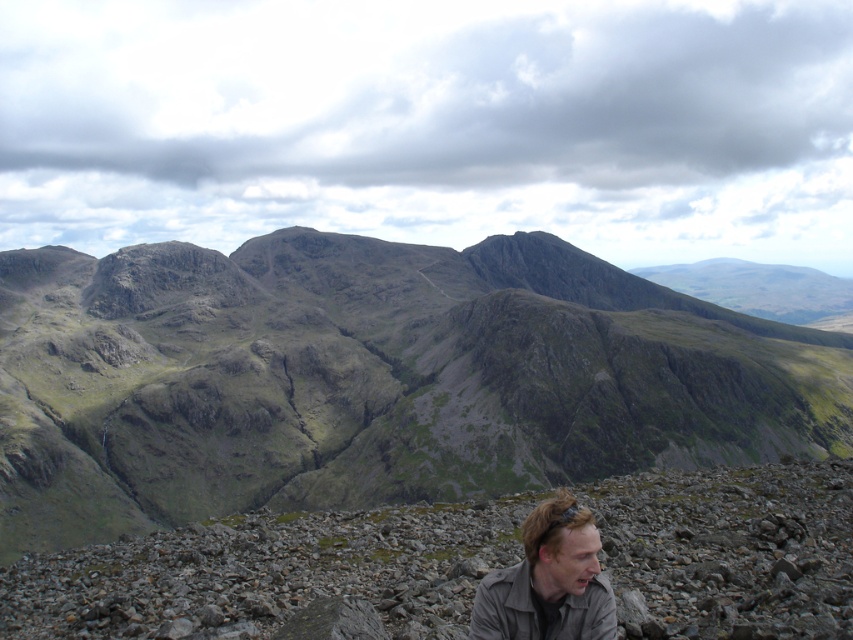
Question: Which object is the closest to the gray gravelly rocks at lower right?

Choices:
 (A) rugged stone mountain at center
 (B) light brown leather jacket at lower center

Answer: (B)

Question: Based on their relative distances, which object is farther from the gray gravelly rocks at lower right?

Choices:
 (A) rugged stone mountain at center
 (B) light brown leather jacket at lower center

Answer: (A)

Question: Is rugged stone mountain at center in front of light brown leather jacket at lower center?

Choices:
 (A) no
 (B) yes

Answer: (A)

Question: Which point is closer to the camera?

Choices:
 (A) gray gravelly rocks at lower right
 (B) rugged stone mountain at center
 (C) light brown leather jacket at lower center

Answer: (C)

Question: Does rugged stone mountain at center appear on the left side of gray gravelly rocks at lower right?

Choices:
 (A) no
 (B) yes

Answer: (B)

Question: Does rugged stone mountain at center have a smaller size compared to gray gravelly rocks at lower right?

Choices:
 (A) no
 (B) yes

Answer: (A)